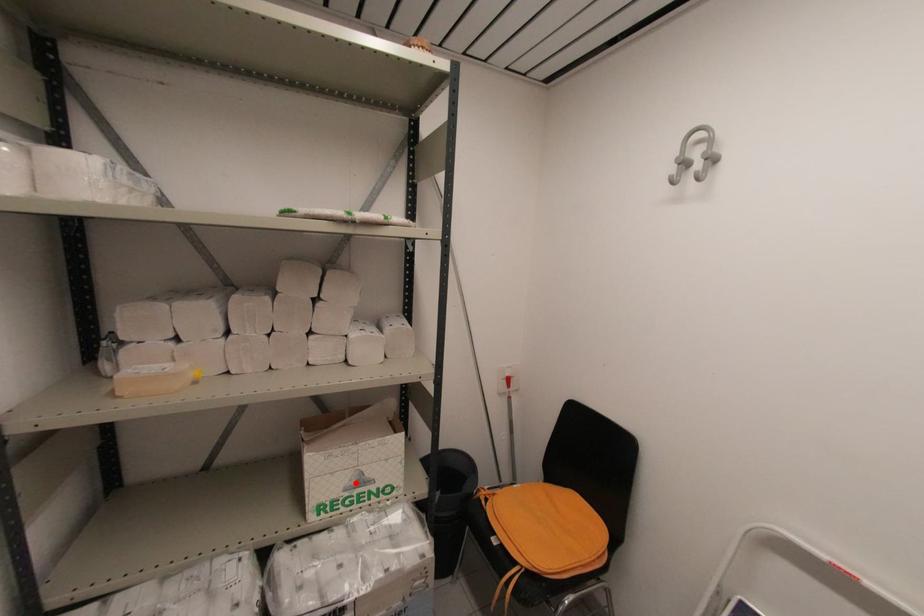
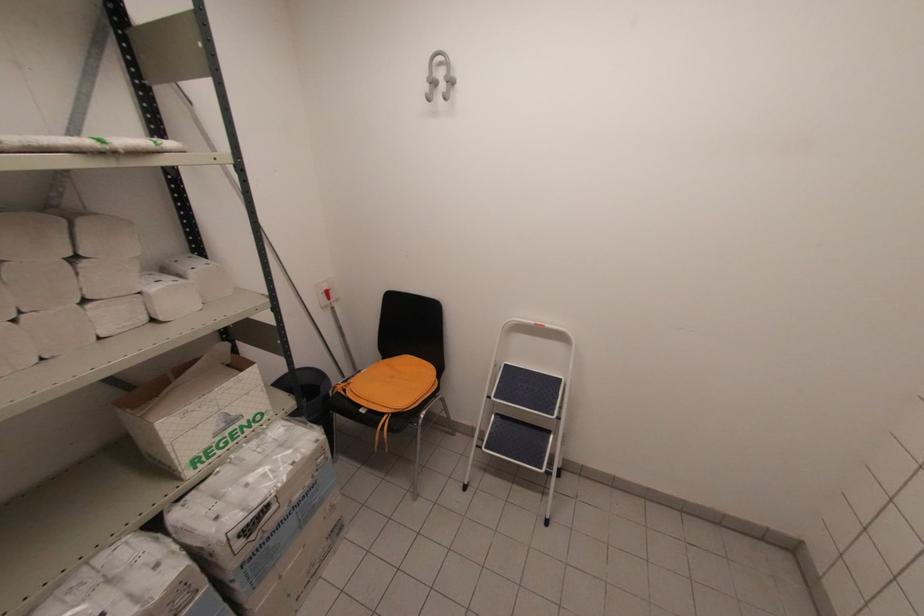
Question: I am providing you with two images of the same scene from different viewpoints. Given a red point in image1, look at the same physical point in image2. Is it:

Choices:
 (A) Closer to the viewpoint
 (B) Farther from the viewpoint

Answer: (A)